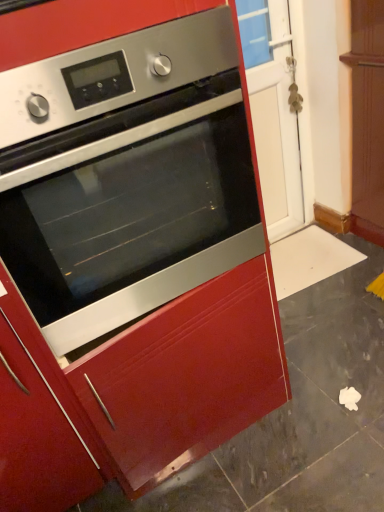
Question: From the image's perspective, does stainless steel oven at center appear lower than transparent glass door at center?

Choices:
 (A) yes
 (B) no

Answer: (A)

Question: Does stainless steel oven at center lie behind transparent glass door at center?

Choices:
 (A) no
 (B) yes

Answer: (A)

Question: Does stainless steel oven at center have a greater width compared to transparent glass door at center?

Choices:
 (A) no
 (B) yes

Answer: (B)

Question: Is stainless steel oven at center oriented away from transparent glass door at center?

Choices:
 (A) no
 (B) yes

Answer: (A)

Question: From the image's perspective, is stainless steel oven at center on transparent glass door at center?

Choices:
 (A) no
 (B) yes

Answer: (A)

Question: Can you confirm if stainless steel oven at center is shorter than transparent glass door at center?

Choices:
 (A) yes
 (B) no

Answer: (A)

Question: Is glossy wood drawer at center at the left side of transparent glass door at center?

Choices:
 (A) yes
 (B) no

Answer: (A)

Question: Is glossy wood drawer at center wider than transparent glass door at center?

Choices:
 (A) yes
 (B) no

Answer: (A)

Question: Can you confirm if glossy wood drawer at center is shorter than transparent glass door at center?

Choices:
 (A) no
 (B) yes

Answer: (B)

Question: Could you tell me if glossy wood drawer at center is turned towards transparent glass door at center?

Choices:
 (A) yes
 (B) no

Answer: (B)

Question: From the image's perspective, does glossy wood drawer at center appear higher than transparent glass door at center?

Choices:
 (A) no
 (B) yes

Answer: (A)

Question: Are glossy wood drawer at center and transparent glass door at center beside each other?

Choices:
 (A) yes
 (B) no

Answer: (B)

Question: Does glossy wood drawer at center have a lesser height compared to stainless steel oven at center?

Choices:
 (A) no
 (B) yes

Answer: (B)